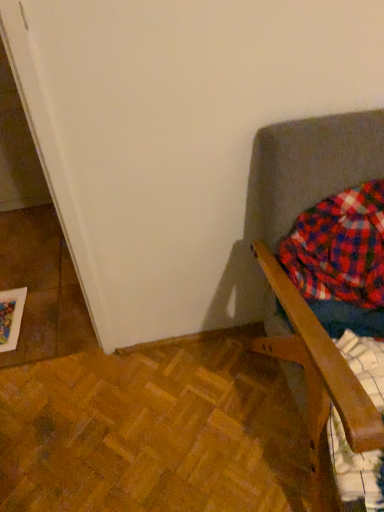
The image size is (384, 512). What do you see at coordinates (309, 167) in the screenshot?
I see `wooden chair at right` at bounding box center [309, 167].

Locate an element on the screen. wooden chair at right is located at coordinates (309, 167).

The image size is (384, 512). Describe the element at coordinates (339, 248) in the screenshot. I see `flannel plaid shirt at right` at that location.

In order to face flannel plaid shirt at right, should I rotate leftwards or rightwards?

Turn right by 20.824 degrees to look at flannel plaid shirt at right.

At what (x,y) coordinates should I click in order to perform the action: click on flannel plaid shirt at right. Please return your answer as a coordinate pair (x, y). Looking at the image, I should click on (339, 248).

Where is `wooden chair at right`? This screenshot has height=512, width=384. wooden chair at right is located at coordinates (309, 167).

Can you confirm if flannel plaid shirt at right is positioned to the right of wooden chair at right?

Incorrect, flannel plaid shirt at right is not on the right side of wooden chair at right.

Does flannel plaid shirt at right lie behind wooden chair at right?

Yes, flannel plaid shirt at right is further from the camera.

Does point (382, 267) come closer to viewer compared to point (366, 175)?

No, it is not.

From the image's perspective, is flannel plaid shirt at right beneath wooden chair at right?

Actually, flannel plaid shirt at right appears above wooden chair at right in the image.

From a real-world perspective, is flannel plaid shirt at right located higher than wooden chair at right?

Yes, from a real-world perspective, flannel plaid shirt at right is over wooden chair at right

Does flannel plaid shirt at right have a greater width compared to wooden chair at right?

In fact, flannel plaid shirt at right might be narrower than wooden chair at right.

From the picture: Considering the sizes of flannel plaid shirt at right and wooden chair at right in the image, is flannel plaid shirt at right taller or shorter than wooden chair at right?

Clearly, flannel plaid shirt at right is shorter compared to wooden chair at right.

Considering the relative sizes of flannel plaid shirt at right and wooden chair at right in the image provided, is flannel plaid shirt at right smaller than wooden chair at right?

Yes, flannel plaid shirt at right is smaller than wooden chair at right.

Is wooden chair at right inside flannel plaid shirt at right?

Definitely not — wooden chair at right is not inside flannel plaid shirt at right.

Would you consider flannel plaid shirt at right to be distant from wooden chair at right?

Actually, flannel plaid shirt at right and wooden chair at right are a little close together.

Is flannel plaid shirt at right turned away from wooden chair at right?

Yes.

From the picture: How distant is flannel plaid shirt at right from wooden chair at right?

flannel plaid shirt at right and wooden chair at right are 4.40 inches apart from each other.

You are a GUI agent. You are given a task and a screenshot of the screen. Output one action in this format:
    pyautogui.click(x=<x>, y=<y>)
    Task: Click on the furniture lying below the flannel plaid shirt at right (from the image's perspective)
    The height and width of the screenshot is (512, 384).
    Given the screenshot: What is the action you would take?
    pyautogui.click(x=309, y=167)

Is wooden chair at right to the left or to the right of flannel plaid shirt at right in the image?

From the image, it's evident that wooden chair at right is to the right of flannel plaid shirt at right.

Considering the relative positions of wooden chair at right and flannel plaid shirt at right in the image provided, is wooden chair at right in front of flannel plaid shirt at right?

Yes, the depth of wooden chair at right is less than that of flannel plaid shirt at right.

Is point (247, 218) behind point (349, 288)?

That is True.

From the image's perspective, which object appears higher, wooden chair at right or flannel plaid shirt at right?

From the image's view, flannel plaid shirt at right is above.

From a real-world perspective, is wooden chair at right physically located above or below flannel plaid shirt at right?

wooden chair at right is situated lower than flannel plaid shirt at right in the real world.

Considering the sizes of objects wooden chair at right and flannel plaid shirt at right in the image provided, who is wider, wooden chair at right or flannel plaid shirt at right?

wooden chair at right is wider.

Is wooden chair at right shorter than flannel plaid shirt at right?

No, wooden chair at right is not shorter than flannel plaid shirt at right.

Considering the sizes of objects wooden chair at right and flannel plaid shirt at right in the image provided, who is bigger, wooden chair at right or flannel plaid shirt at right?

Bigger between the two is wooden chair at right.

Would you say flannel plaid shirt at right is part of wooden chair at right's contents?

Yes, flannel plaid shirt at right is inside wooden chair at right.

Is wooden chair at right touching flannel plaid shirt at right?

No, wooden chair at right is not making contact with flannel plaid shirt at right.

Looking at this image, could you tell me if wooden chair at right is facing flannel plaid shirt at right?

Yes, wooden chair at right is aimed at flannel plaid shirt at right.

Locate an element on the screen. The width and height of the screenshot is (384, 512). flannel above the wooden chair at right (from a real-world perspective) is located at coordinates (339, 248).

At what (x,y) coordinates should I click in order to perform the action: click on furniture on the right of flannel plaid shirt at right. Please return your answer as a coordinate pair (x, y). Looking at the image, I should click on (309, 167).

The height and width of the screenshot is (512, 384). I want to click on furniture beneath the flannel plaid shirt at right (from a real-world perspective), so click(x=309, y=167).